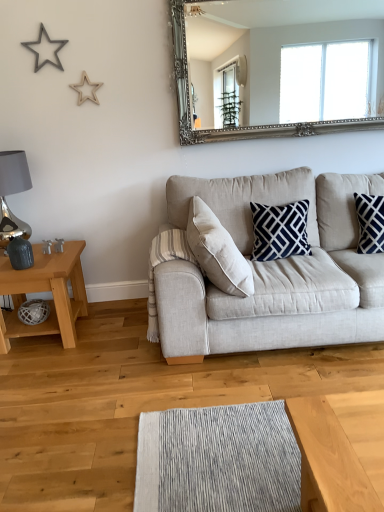
Question: Is beige fabric couch at center at the right side of silver ornate mirror at upper center?

Choices:
 (A) no
 (B) yes

Answer: (B)

Question: Considering the relative sizes of beige fabric couch at center and silver ornate mirror at upper center in the image provided, is beige fabric couch at center smaller than silver ornate mirror at upper center?

Choices:
 (A) no
 (B) yes

Answer: (A)

Question: Considering the relative sizes of beige fabric couch at center and silver ornate mirror at upper center in the image provided, is beige fabric couch at center wider than silver ornate mirror at upper center?

Choices:
 (A) yes
 (B) no

Answer: (A)

Question: From a real-world perspective, is beige fabric couch at center positioned over silver ornate mirror at upper center based on gravity?

Choices:
 (A) no
 (B) yes

Answer: (A)

Question: Is silver ornate mirror at upper center at the back of beige fabric couch at center?

Choices:
 (A) yes
 (B) no

Answer: (B)

Question: Visually, is silver ornate mirror at upper center positioned to the left or to the right of beige fabric couch at center?

Choices:
 (A) right
 (B) left

Answer: (B)

Question: Looking at their shapes, would you say silver ornate mirror at upper center is wider or thinner than beige fabric couch at center?

Choices:
 (A) wide
 (B) thin

Answer: (B)

Question: Based on their sizes in the image, would you say silver ornate mirror at upper center is bigger or smaller than beige fabric couch at center?

Choices:
 (A) big
 (B) small

Answer: (B)

Question: Is silver ornate mirror at upper center in front of or behind beige fabric couch at center in the image?

Choices:
 (A) front
 (B) behind

Answer: (B)

Question: Relative to matte wooden table at left, is silver ornate mirror at upper center in front or behind?

Choices:
 (A) front
 (B) behind

Answer: (B)

Question: From the image's perspective, is silver ornate mirror at upper center above or below matte wooden table at left?

Choices:
 (A) below
 (B) above

Answer: (B)

Question: Which is correct: silver ornate mirror at upper center is inside matte wooden table at left, or outside of it?

Choices:
 (A) inside
 (B) outside

Answer: (B)

Question: In the image, is silver ornate mirror at upper center on the left side or the right side of matte wooden table at left?

Choices:
 (A) left
 (B) right

Answer: (B)

Question: From a real-world perspective, relative to silver ornate mirror at upper center, is beige fabric couch at center vertically above or below?

Choices:
 (A) below
 (B) above

Answer: (A)

Question: In terms of width, does beige fabric couch at center look wider or thinner when compared to silver ornate mirror at upper center?

Choices:
 (A) wide
 (B) thin

Answer: (A)